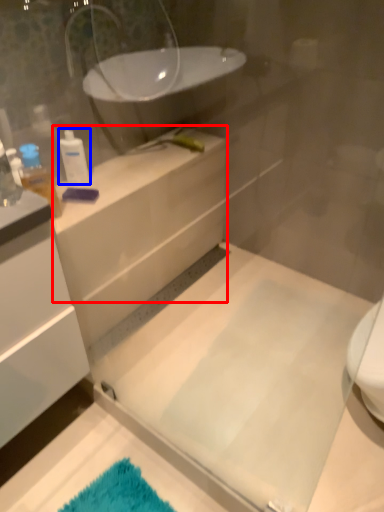
Question: Which of the following is the closest to the observer, counter top (highlighted by a red box) or toiletry (highlighted by a blue box)?

Choices:
 (A) counter top
 (B) toiletry

Answer: (A)